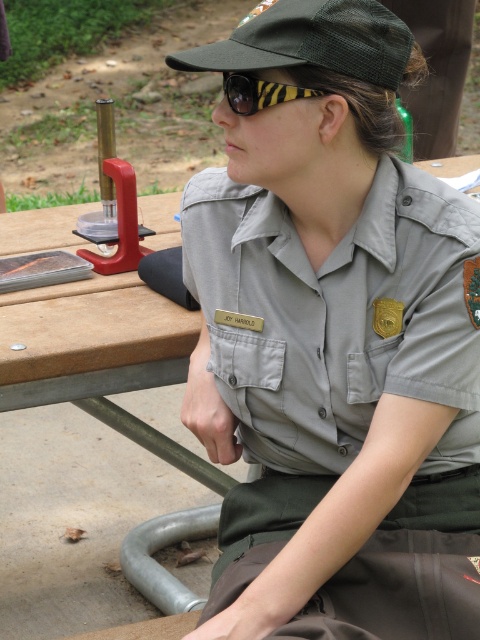
Question: Where is gray fabric uniform at center located in relation to black striped goggles at upper center in the image?

Choices:
 (A) below
 (B) above

Answer: (A)

Question: Is gray fabric uniform at center wider than black striped goggles at upper center?

Choices:
 (A) yes
 (B) no

Answer: (A)

Question: Is gray fabric uniform at center above black striped goggles at upper center?

Choices:
 (A) no
 (B) yes

Answer: (A)

Question: Which point is closer to the camera taking this photo?

Choices:
 (A) (316, 451)
 (B) (244, 108)

Answer: (B)

Question: Which point is closer to the camera?

Choices:
 (A) black striped goggles at upper center
 (B) gray fabric uniform at center

Answer: (A)